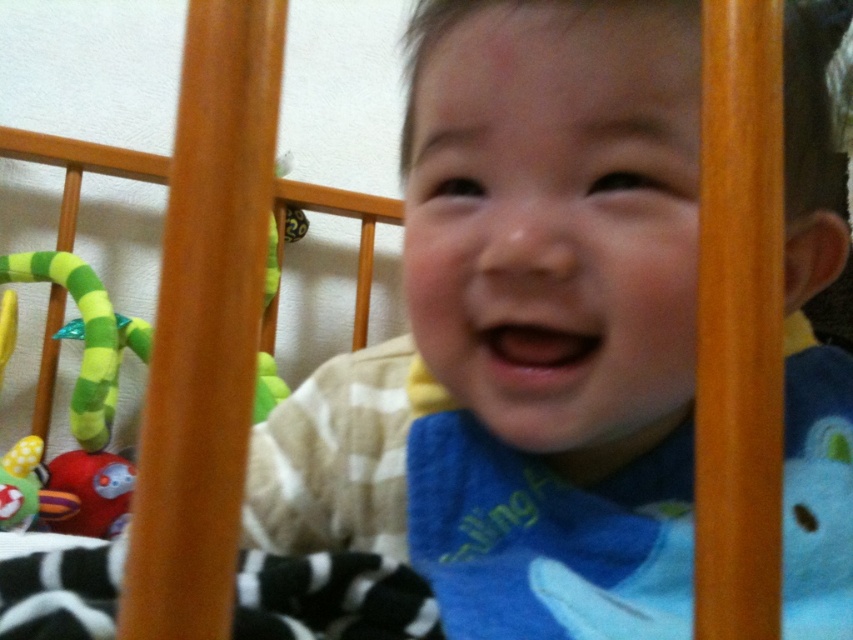
You are a delivery robot trying to deliver a package to the point marked as point (83, 467) in the image. The robot has a maximum delivery range of 1 meter. Can you successfully deliver the package to that point?

The distance of point (83, 467) from camera is 1.06 meters, so the robot cannot deliver the package as it exceeds the maximum range of 1 meter.